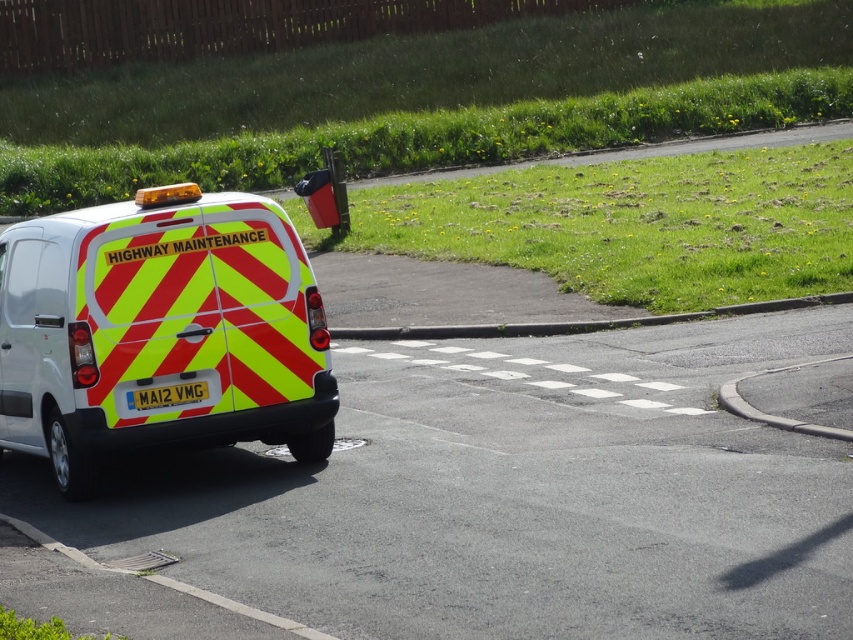
You are a traffic officer assessing the positioning of vehicles on the road. The reflective yellow and red van at left is part of a highway maintenance crew. Based on its position, can you determine if it is properly positioned according to standard safety protocols that require all maintenance vehicles to park at least 10 meters away from the nearest traffic light?

The reflective yellow and red van at left is located at point (x=160, y=330). However, without knowing the exact coordinates of the traffic light or the scale of the image, it is impossible to determine if it meets the 10 meters requirement. Further information is needed to assess compliance with safety protocols.

You are standing in front of the white van and want to locate two specific points on its rear. The first point is at coordinates point [257,253], and the second is at point [164,388]. Which of these points is closer to you?

Point [257,253] is closer to you because it is further to the viewer than point [164,388].